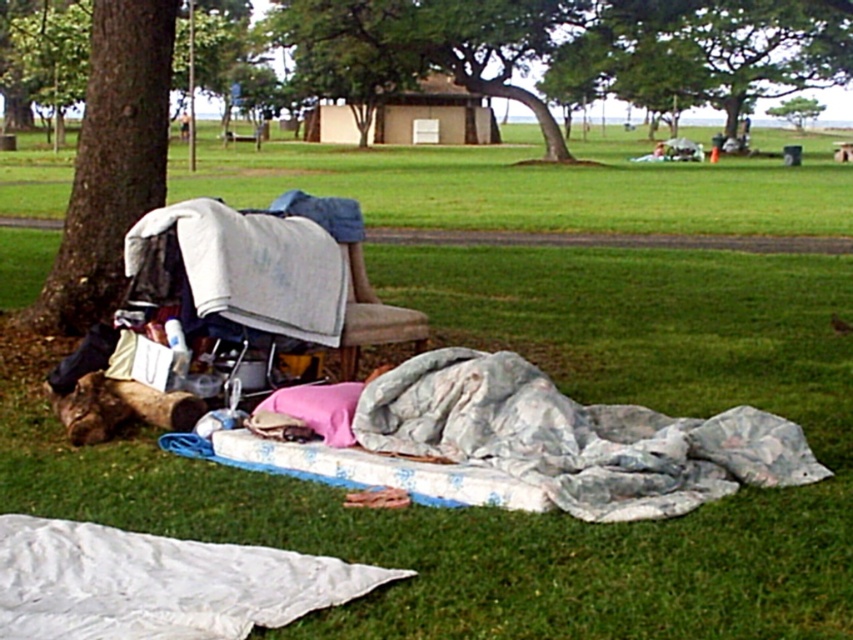
Question: Which of the following is the closest to the observer?

Choices:
 (A) fluffy white blanket at lower right
 (B) brown rough bark tree at left

Answer: (A)

Question: Is brown rough bark tree at left above white fabric at left?

Choices:
 (A) no
 (B) yes

Answer: (B)

Question: Among these objects, which one is farthest from the camera?

Choices:
 (A) green leafy tree at upper center
 (B) fluffy white blanket at lower right
 (C) green leafy tree at center

Answer: (A)

Question: In this image, where is fluffy white blanket at lower right located relative to green leafy tree at upper center?

Choices:
 (A) left
 (B) right

Answer: (A)

Question: Is fluffy white blanket at lower right behind brown rough bark tree at left?

Choices:
 (A) yes
 (B) no

Answer: (B)

Question: Which object is closer to the camera taking this photo?

Choices:
 (A) brown rough bark tree at left
 (B) green leafy tree at center
 (C) fluffy white blanket at lower right
 (D) white fabric at left

Answer: (C)